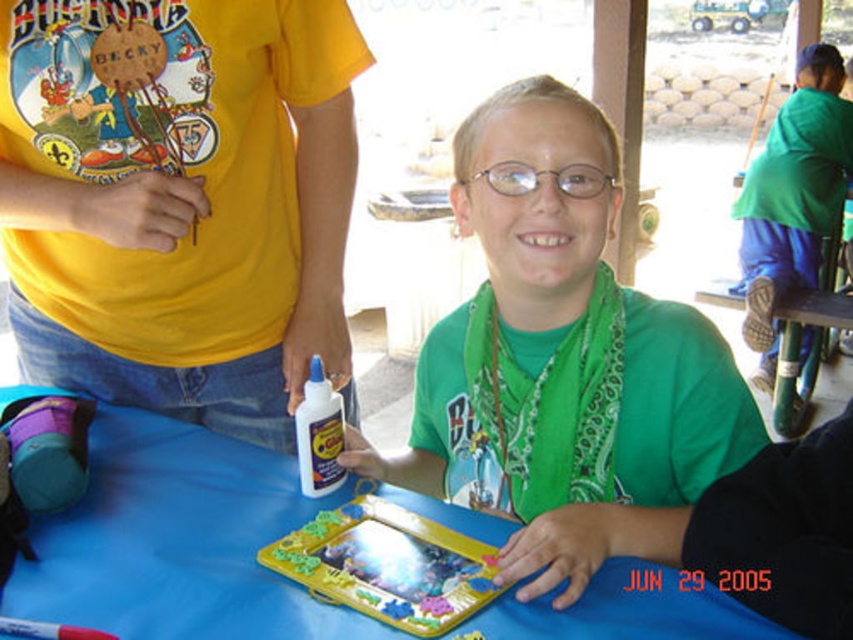
Question: Which point is farther to the camera?

Choices:
 (A) (384, 577)
 (B) (294, 499)

Answer: (B)

Question: Estimate the real-world distances between objects in this image. Which object is closer to the blue fabric table at center?

Choices:
 (A) green fabric scarf at upper right
 (B) clear plastic glasses at center
 (C) yellow plastic board game at center

Answer: (C)

Question: Which of these objects is positioned farthest from the green fabric scarf at upper right?

Choices:
 (A) clear plastic glasses at center
 (B) blue fabric table at center
 (C) green matte shirt at center
 (D) yellow plastic board game at center

Answer: (B)

Question: From the image, what is the correct spatial relationship of blue fabric table at center in relation to green fabric scarf at upper right?

Choices:
 (A) right
 (B) left

Answer: (B)

Question: Can you confirm if blue fabric table at center is thinner than yellow plastic board game at center?

Choices:
 (A) no
 (B) yes

Answer: (A)

Question: Is green matte shirt at center below clear plastic glasses at center?

Choices:
 (A) no
 (B) yes

Answer: (B)